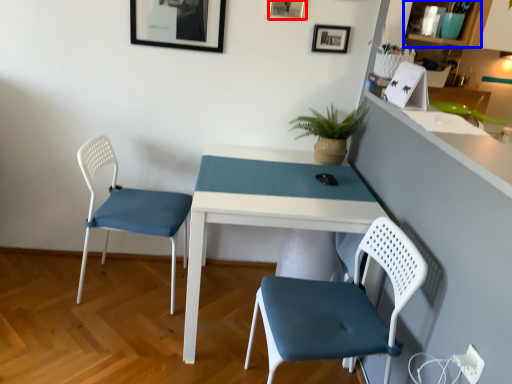
Question: Which object is closer to the camera taking this photo, picture frame (highlighted by a red box) or shelf (highlighted by a blue box)?

Choices:
 (A) picture frame
 (B) shelf

Answer: (B)